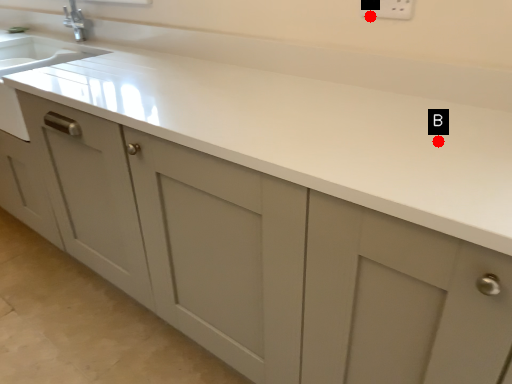
Question: Two points are circled on the image, labeled by A and B beside each circle. Which point is closer to the camera?

Choices:
 (A) A is closer
 (B) B is closer

Answer: (B)